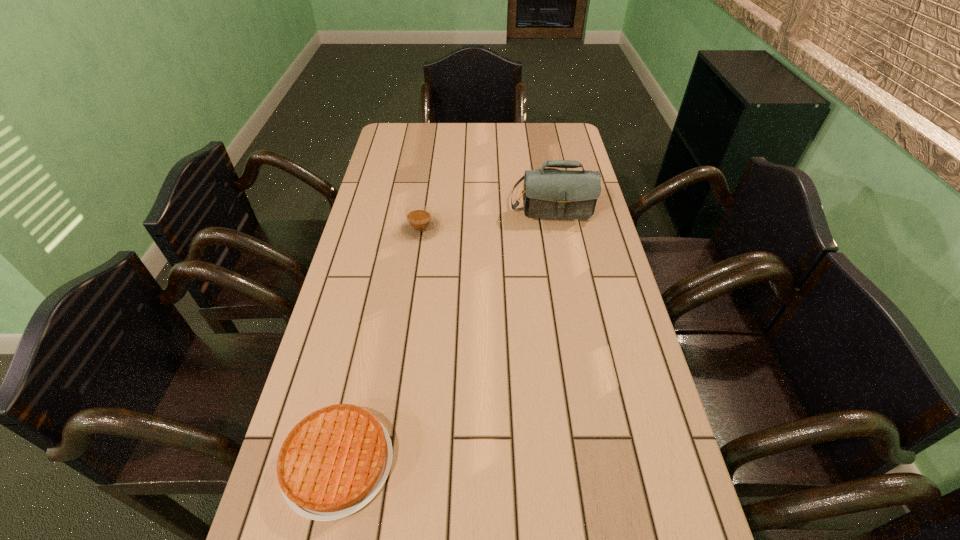
Locate an element on the screen. The width and height of the screenshot is (960, 540). object that is positioned at the right edge is located at coordinates (549, 193).

The width and height of the screenshot is (960, 540). In the image, there is a desktop. In order to click on vacant region at the far edge in this screenshot , I will do `click(503, 144)`.

The width and height of the screenshot is (960, 540). In order to click on vacant space at the left edge of the desktop in this screenshot , I will do `click(372, 329)`.

Image resolution: width=960 pixels, height=540 pixels. In the image, there is a desktop. Find the location of `free space at the right edge`. free space at the right edge is located at coordinates (611, 421).

The height and width of the screenshot is (540, 960). Identify the location of blank space at the far right corner of the desktop. (549, 143).

The width and height of the screenshot is (960, 540). In order to click on vacant point located between the second shortest object and the pie in this screenshot , I will do `click(379, 346)`.

Where is `vacant area that lies between the second tallest object and the pie`? This screenshot has width=960, height=540. vacant area that lies between the second tallest object and the pie is located at coordinates (379, 346).

In order to click on blank region between the second tallest object and the shoulder bag in this screenshot , I will do `click(486, 213)`.

Locate an element on the screen. The image size is (960, 540). free space between the cappuccino and the shoulder bag is located at coordinates (486, 213).

This screenshot has width=960, height=540. Identify the location of unoccupied area between the rightmost object and the second shortest object. (486, 213).